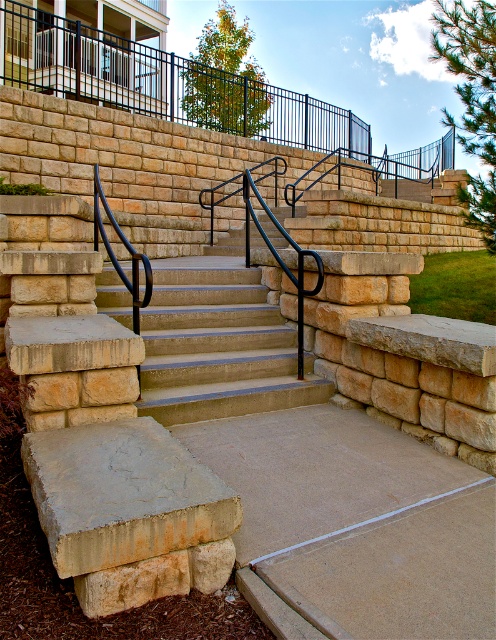
Is black metal railing at upper center above smooth stone stairs at center?

Yes.

Can you confirm if black metal railing at upper center is positioned to the left of smooth stone stairs at center?

Incorrect, black metal railing at upper center is not on the left side of smooth stone stairs at center.

Who is more forward, (220, 115) or (272, 333)?

Point (272, 333) is in front.

I want to click on black metal railing at upper center, so click(x=189, y=92).